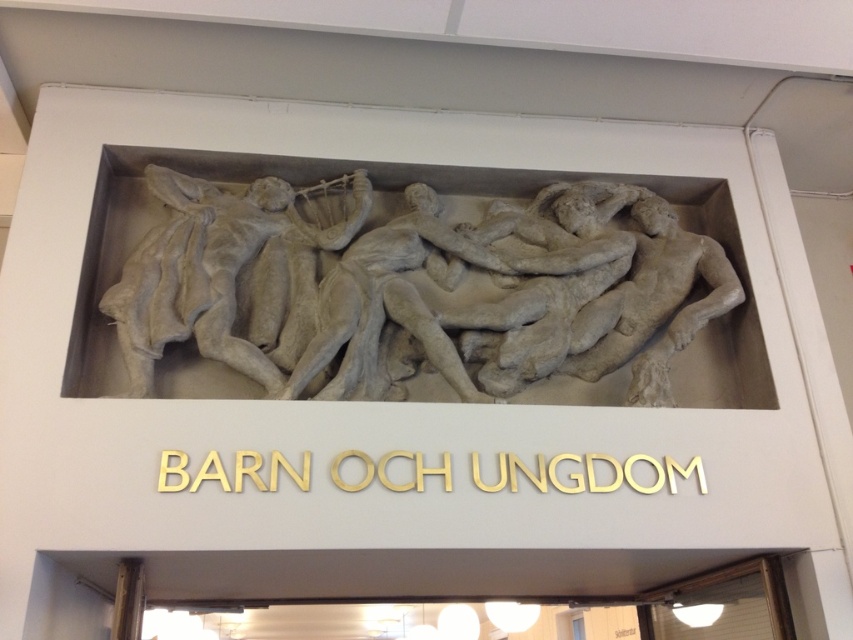
You are an architect designing a new entranceway and want to ensure proper spacing between the white stone relief at center and the gray stone sculpture at center. According to the scene, which object is placed below the other?

The white stone relief at center is positioned under the gray stone sculpture at center, so the relief is below the sculpture.

You are an art student analyzing the sculptural relief above an entrance. You notice the white stone relief at center and the gray stone sculpture at center. Which one is bigger in size?

The white stone relief at center is larger in size than the gray stone sculpture at center.

From the picture: You are standing in front of a sculptural relief above an entrance. You notice two objects, the white stone relief at center and the gray stone sculpture at center. Which one appears closer to you?

The white stone relief at center appears closer to you because it is further to the viewer than the gray stone sculpture at center.